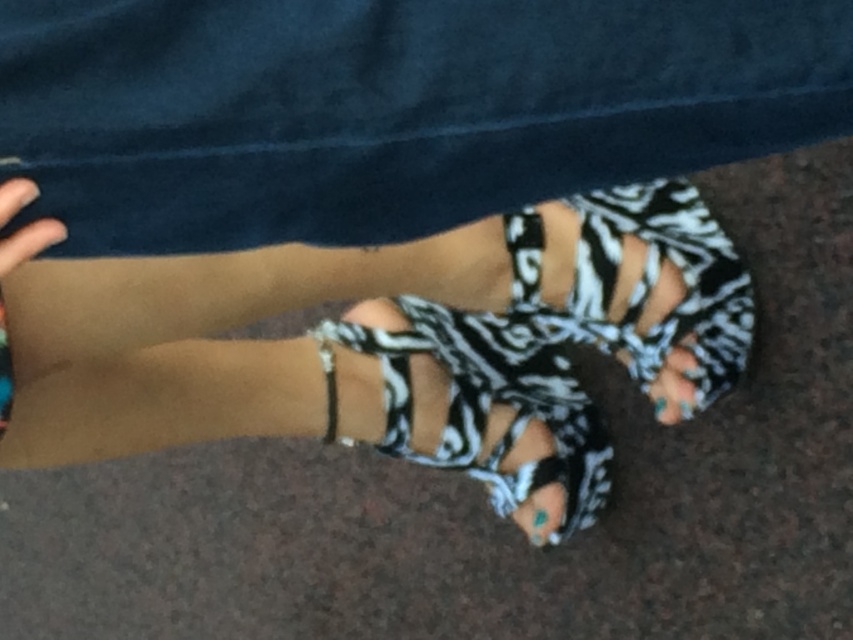
Question: Which point appears farthest from the camera in this image?

Choices:
 (A) (685, 376)
 (B) (502, 378)

Answer: (B)

Question: Is zebra-patterned fabric sandal at lower center thinner than zebra-patterned toe at lower right?

Choices:
 (A) yes
 (B) no

Answer: (B)

Question: Is zebra-patterned fabric sandal at lower center positioned in front of zebra-patterned toe at lower right?

Choices:
 (A) no
 (B) yes

Answer: (B)

Question: Can you confirm if zebra-patterned fabric sandal at lower center is thinner than zebra-patterned toe at lower right?

Choices:
 (A) no
 (B) yes

Answer: (A)